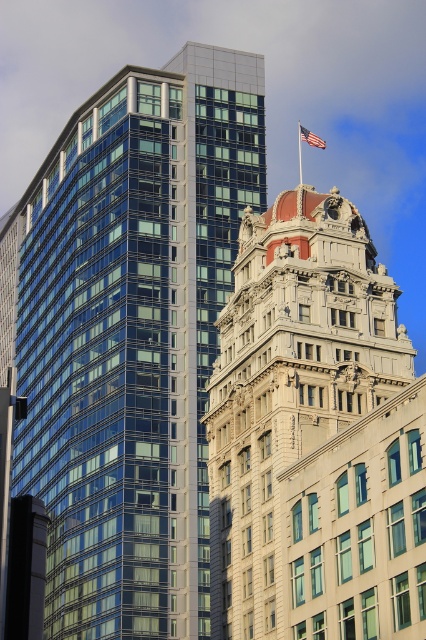
Can you confirm if glassy steel skyscraper at left is positioned above american flag at center?

Incorrect, glassy steel skyscraper at left is not positioned above american flag at center.

Does glassy steel skyscraper at left have a larger size compared to american flag at center?

Correct, glassy steel skyscraper at left is larger in size than american flag at center.

Does point (100, 116) come closer to viewer compared to point (305, 134)?

Yes, point (100, 116) is in front of point (305, 134).

The height and width of the screenshot is (640, 426). In order to click on glassy steel skyscraper at left in this screenshot , I will do `click(129, 336)`.

Can you confirm if glassy steel skyscraper at left is smaller than white stone tower at center?

Actually, glassy steel skyscraper at left might be larger than white stone tower at center.

Is glassy steel skyscraper at left thinner than white stone tower at center?

Incorrect, glassy steel skyscraper at left's width is not less than white stone tower at center's.

Between point (123, 292) and point (316, 477), which one is positioned behind?

The point (123, 292) is behind.

Locate an element on the screen. The image size is (426, 640). glassy steel skyscraper at left is located at coordinates (129, 336).

Is white stone tower at center above american flag at center?

No, white stone tower at center is not above american flag at center.

Which is more to the right, white stone tower at center or american flag at center?

american flag at center is more to the right.

Does point (367, 596) lie behind point (299, 132)?

No.

Image resolution: width=426 pixels, height=640 pixels. Identify the location of white stone tower at center. (314, 436).